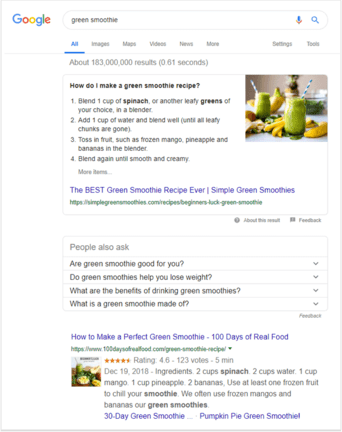
Image resolution: width=342 pixels, height=432 pixels. I want to click on mic, so click(x=298, y=19).